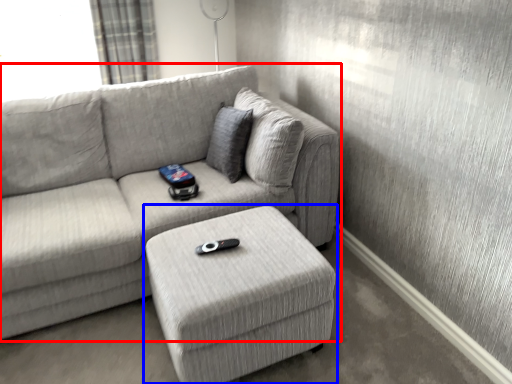
Question: Which object appears closest to the camera in this image, studio couch (highlighted by a red box) or table (highlighted by a blue box)?

Choices:
 (A) studio couch
 (B) table

Answer: (A)